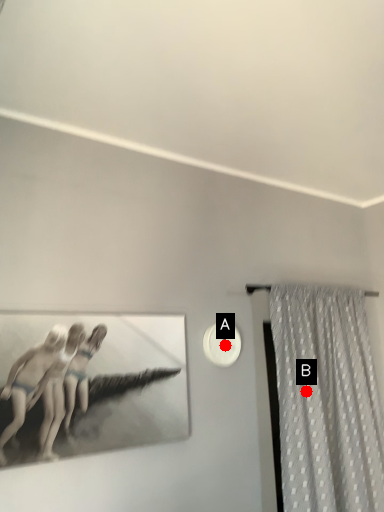
Question: Two points are circled on the image, labeled by A and B beside each circle. Which point is closer to the camera taking this photo?

Choices:
 (A) A is closer
 (B) B is closer

Answer: (A)